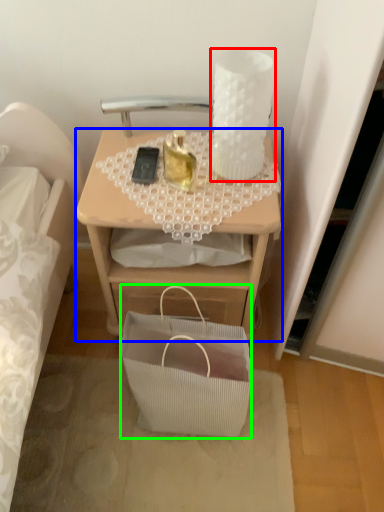
Question: Based on their relative distances, which object is farther from candle holder (highlighted by a red box)? Choose from desk (highlighted by a blue box) and handbag (highlighted by a green box).

Choices:
 (A) desk
 (B) handbag

Answer: (B)